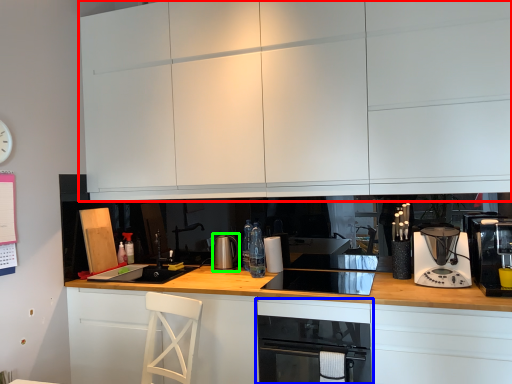
Question: Based on their relative distances, which object is farther from cabinetry (highlighted by a red box)? Choose from home appliance (highlighted by a blue box) and kitchen appliance (highlighted by a green box).

Choices:
 (A) home appliance
 (B) kitchen appliance

Answer: (B)